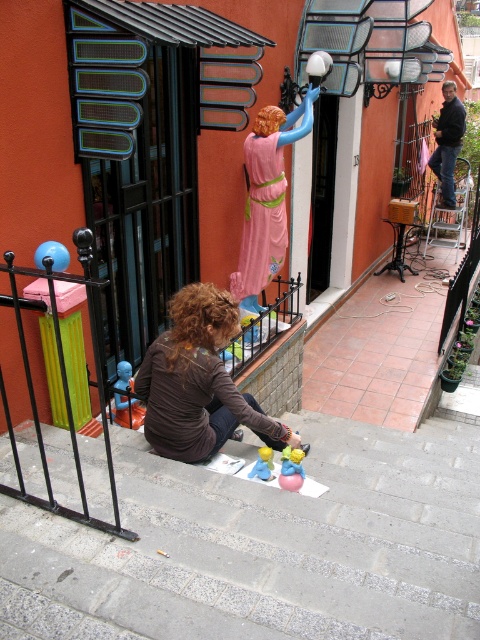
Question: Which of the following is the closest to the observer?

Choices:
 (A) (263, 476)
 (B) (44, 467)
 (C) (292, 449)
 (D) (254, 132)

Answer: (B)

Question: Does pink glossy statue at upper center appear on the left side of pink matte dress at upper center?

Choices:
 (A) no
 (B) yes

Answer: (A)

Question: Which of the following is the closest to the observer?

Choices:
 (A) (257, 464)
 (B) (274, 211)

Answer: (A)

Question: Is brown fabric at center bigger than blue plastic toy at lower left?

Choices:
 (A) no
 (B) yes

Answer: (B)

Question: Considering the real-world distances, which object is closest to the pink glossy statue at upper center?

Choices:
 (A) blue plastic toy at lower left
 (B) matte plastic toy at center

Answer: (A)

Question: Is pink matte dress at upper center positioned behind smooth plastic toy at center?

Choices:
 (A) yes
 (B) no

Answer: (A)